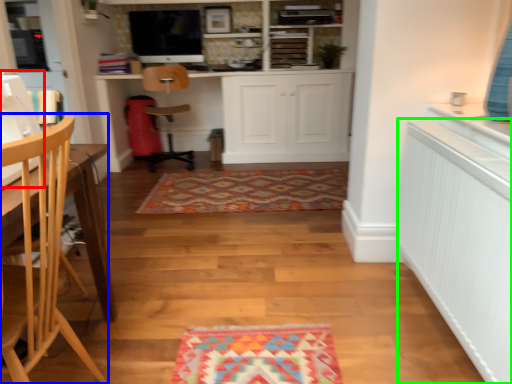
Question: Based on their relative distances, which object is farther from sewing machine (highlighted by a red box)? Choose from chair (highlighted by a blue box) and radiator (highlighted by a green box).

Choices:
 (A) chair
 (B) radiator

Answer: (B)